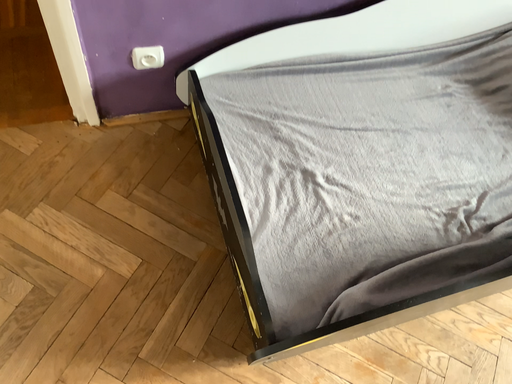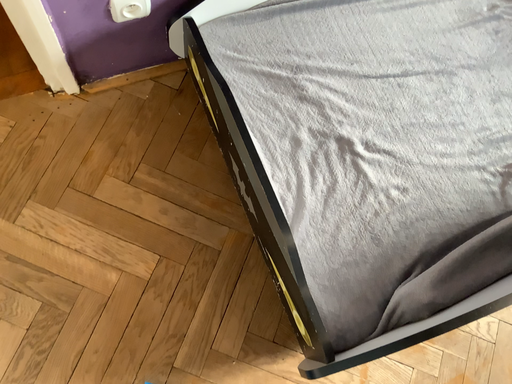
Question: Which way did the camera rotate in the video?

Choices:
 (A) rotated downward
 (B) rotated upward

Answer: (A)